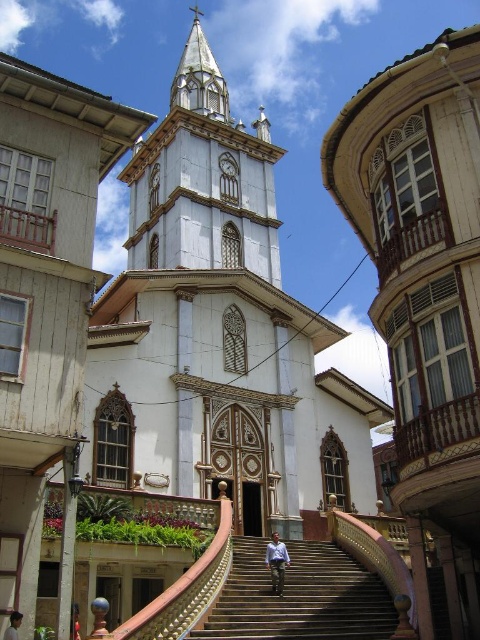
Is dark brown wooden stairs at center above white glossy steeple at center?

Incorrect, dark brown wooden stairs at center is not positioned above white glossy steeple at center.

Based on the photo, is dark brown wooden stairs at center to the left of white glossy steeple at center from the viewer's perspective?

Incorrect, dark brown wooden stairs at center is not on the left side of white glossy steeple at center.

Locate an element on the screen. Image resolution: width=480 pixels, height=640 pixels. dark brown wooden stairs at center is located at coordinates (300, 596).

Who is more forward, [141,264] or [182,93]?

Positioned in front is point [141,264].

Is point (227, 145) farther from camera compared to point (204, 112)?

That is False.

I want to click on white marble clock tower at center, so click(x=203, y=179).

Does dark brown wooden stairs at center appear on the left side of light blue shirt at center?

Incorrect, dark brown wooden stairs at center is not on the left side of light blue shirt at center.

Which is behind, point (232, 598) or point (276, 540)?

The point (276, 540) is more distant.

Find the location of `dark brown wooden stairs at center`. dark brown wooden stairs at center is located at coordinates (300, 596).